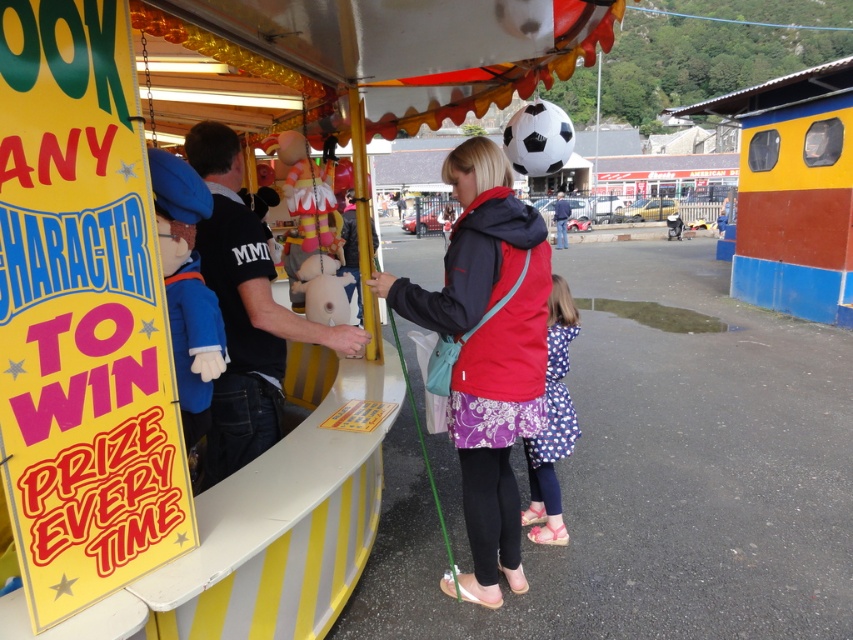
Is point (235, 353) positioned after point (532, 515)?

That is False.

Image resolution: width=853 pixels, height=640 pixels. I want to click on black matte shirt at center, so click(245, 310).

Can you confirm if red fleece jacket at center is taller than blue denim jacket at center?

Indeed, red fleece jacket at center has a greater height compared to blue denim jacket at center.

Which is behind, point (508, 451) or point (560, 196)?

The point (560, 196) is behind.

This screenshot has height=640, width=853. What do you see at coordinates (486, 349) in the screenshot? I see `red fleece jacket at center` at bounding box center [486, 349].

What are the coordinates of `red fleece jacket at center` in the screenshot? It's located at (486, 349).

Between red fleece jacket at center and polka dot fabric dress at lower center, which one is positioned lower?

polka dot fabric dress at lower center is below.

Is red fleece jacket at center closer to the viewer compared to polka dot fabric dress at lower center?

Yes, it is in front of polka dot fabric dress at lower center.

Where is `red fleece jacket at center`? This screenshot has width=853, height=640. red fleece jacket at center is located at coordinates (486, 349).